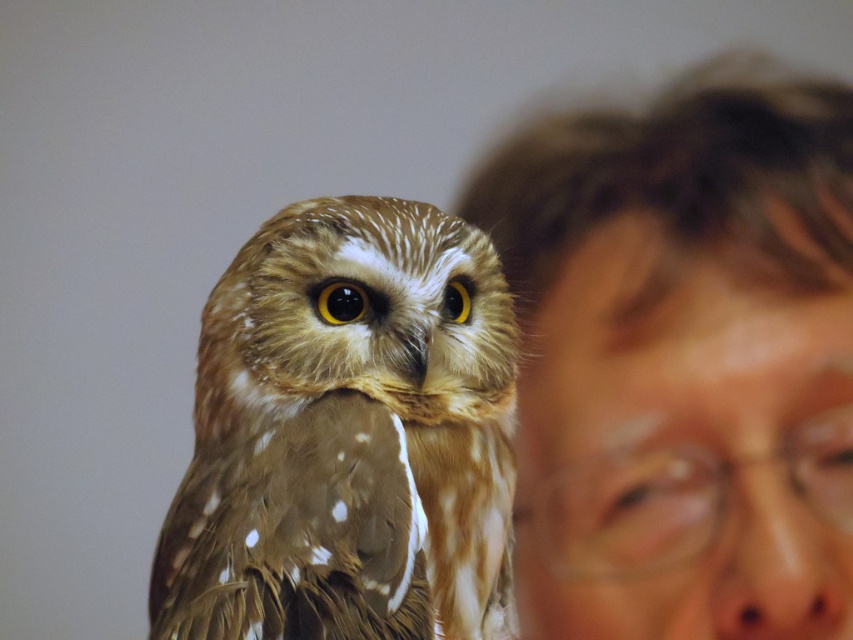
You are an artist trying to sketch the scene. You notice two elements in the image, the smooth skin face at right and the brown speckled feathers at center. Which of these two elements is narrower in width?

The smooth skin face at right has a lesser width compared to the brown speckled feathers at center, so the smooth skin face at right is narrower in width.

You are a photographer who wants to focus on the smooth skin face at right in the image. Based on the coordinates provided, where should you adjust your camera focus to capture this area?

The smooth skin face at right is located at coordinates point (682, 358), so adjust the camera focus to that point to capture it clearly.

You are an artist sketching the scene. You need to decide which object to draw first based on their sizes. Which one should you start with, the smooth skin face at right or the brown speckled feathers at center?

The smooth skin face at right is bigger than the brown speckled feathers at center, so you should start with the smooth skin face at right since it requires more space on the paper.